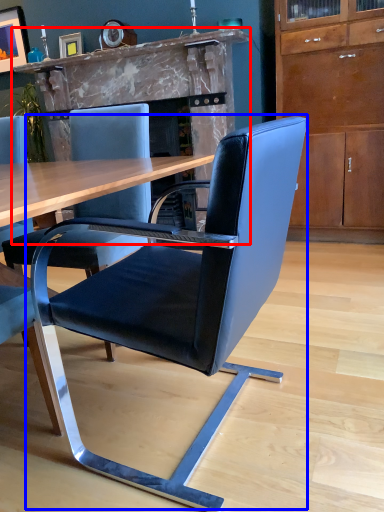
Question: Among these objects, which one is farthest to the camera, fireplace (highlighted by a red box) or chair (highlighted by a blue box)?

Choices:
 (A) fireplace
 (B) chair

Answer: (A)